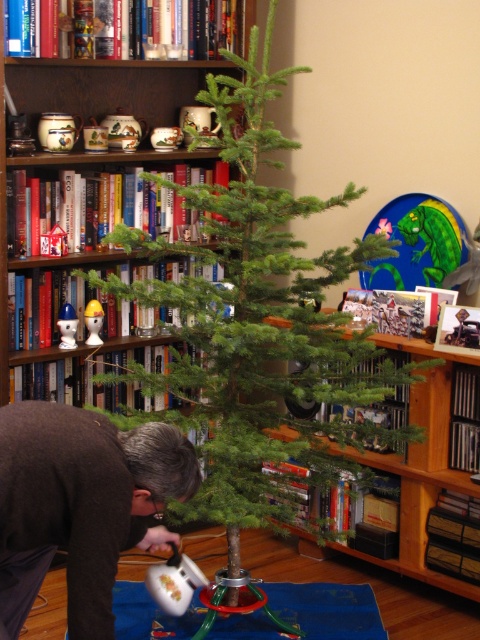
In the scene shown: You are standing in the room and want to place a gift under the green matte christmas tree at center. To ensure the gift is visible from the entrance, which is near the brown wooden bookcase at center, which object should you place the gift closer to?

A: The green matte christmas tree at center is to the right of the brown wooden bookcase at center. To make the gift visible from the entrance near the bookcase, place it closer to the brown wooden bookcase at center side of the tree.

You are a visitor in the room and want to place a gift under the green matte christmas tree at center. However, you notice the wooden bookshelf at center is in the way. Can you easily walk around the bookshelf to reach the tree?

The green matte christmas tree at center is positioned over wooden bookshelf at center, which means the tree is in front of the bookshelf. Since the bookshelf is behind the tree, you can easily walk around it to reach the tree.

You are standing at the origin point in the room where the Christmas tree is located. The brown wooden bookcase at center is at coordinates 0.105, 0.275. If you want to walk directly to the bookcase, which direction should you head?

Since the brown wooden bookcase at center is located at coordinates (132, 67), you should head towards the coordinates (132, 67) to reach it directly.